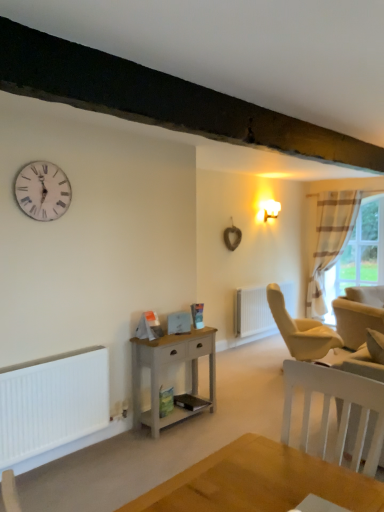
You are a GUI agent. You are given a task and a screenshot of the screen. Output one action in this format:
    pyautogui.click(x=<x>, y=<y>)
    Task: Click on the free location to the right of white matte heater at lower left
    Image resolution: width=384 pixels, height=512 pixels.
    Given the screenshot: What is the action you would take?
    pyautogui.click(x=100, y=460)